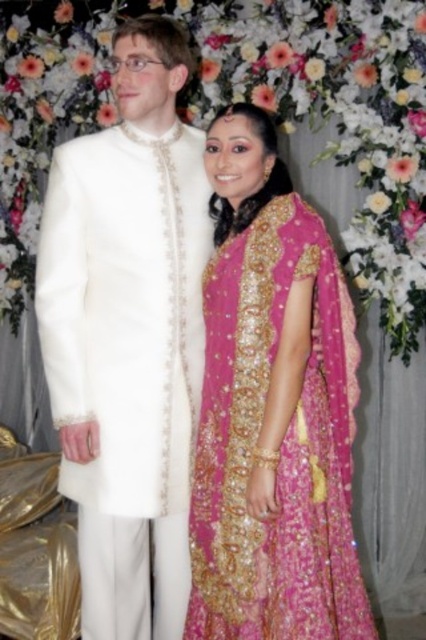
Question: Which object appears closest to the camera in this image?

Choices:
 (A) fuchsia satin lehenga at center
 (B) white satin sherwani at left

Answer: (A)

Question: Is white satin sherwani at left to the left of fuchsia satin lehenga at center from the viewer's perspective?

Choices:
 (A) no
 (B) yes

Answer: (B)

Question: Is white satin sherwani at left smaller than fuchsia satin lehenga at center?

Choices:
 (A) no
 (B) yes

Answer: (A)

Question: From the image, what is the correct spatial relationship of white satin sherwani at left in relation to fuchsia satin lehenga at center?

Choices:
 (A) right
 (B) left

Answer: (B)

Question: Which point appears closest to the camera in this image?

Choices:
 (A) (250, 227)
 (B) (146, 612)

Answer: (A)